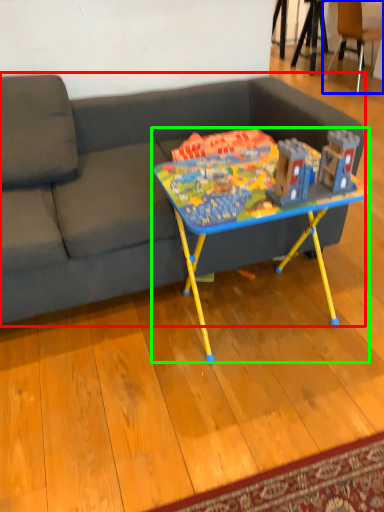
Question: Which object is the closest to the studio couch (highlighted by a red box)? Choose among these: chair (highlighted by a blue box) or table (highlighted by a green box).

Choices:
 (A) chair
 (B) table

Answer: (B)